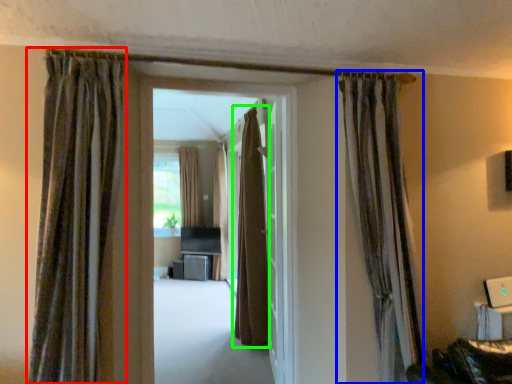
Question: Considering the real-world distances, which object is farthest from curtain (highlighted by a red box)? curtain (highlighted by a blue box) or curtain (highlighted by a green box)?

Choices:
 (A) curtain
 (B) curtain

Answer: (B)